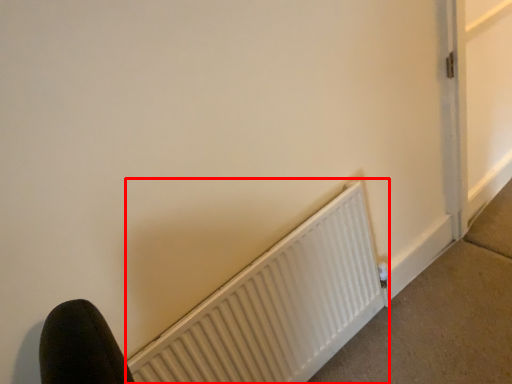
Question: From the image's perspective, where is radiator (annotated by the red box) located in relation to concrete in the image?

Choices:
 (A) above
 (B) below

Answer: (A)